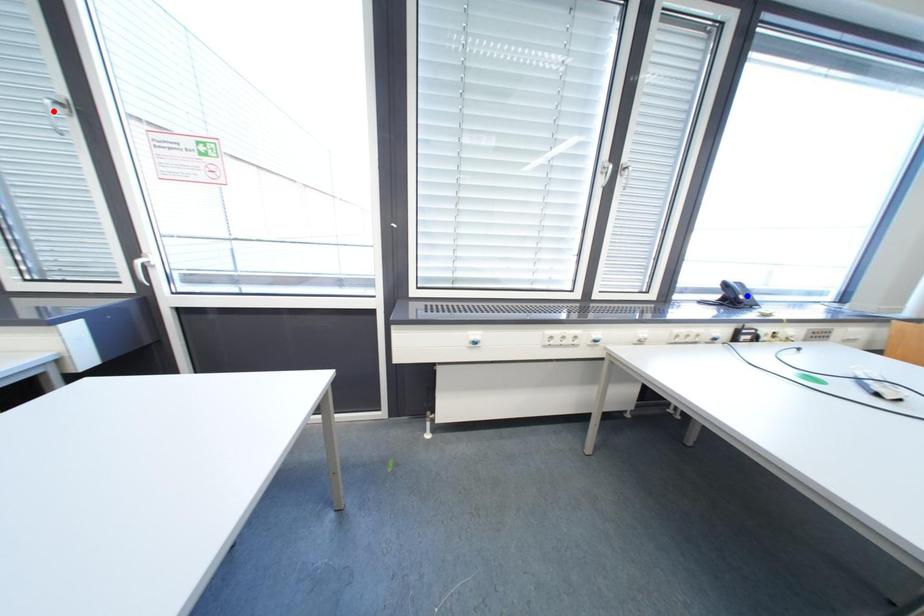
Question: Which of the two points in the image is closer to the camera?

Choices:
 (A) Blue point is closer.
 (B) Red point is closer.

Answer: (B)